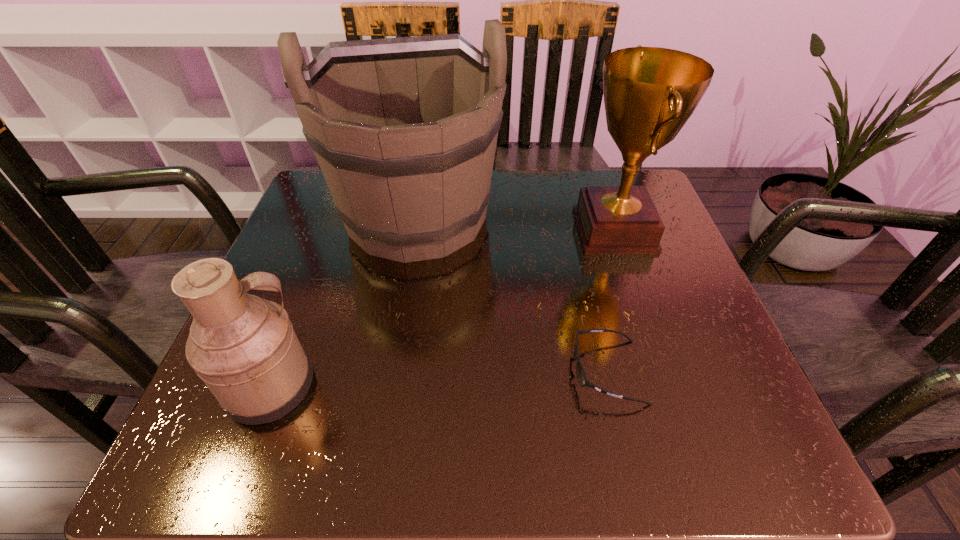
Where is `vacant space located on the front-facing side of the shortest object`? The width and height of the screenshot is (960, 540). vacant space located on the front-facing side of the shortest object is located at coordinates (443, 372).

The height and width of the screenshot is (540, 960). I want to click on vacant space located on the front-facing side of the shortest object, so click(x=490, y=372).

Find the location of `bucket at the far edge`. bucket at the far edge is located at coordinates (405, 129).

Where is `award positioned at the far edge`? This screenshot has height=540, width=960. award positioned at the far edge is located at coordinates (649, 93).

At what (x,y) coordinates should I click in order to perform the action: click on object at the near edge. Please return your answer as a coordinate pair (x, y). The height and width of the screenshot is (540, 960). Looking at the image, I should click on (244, 348).

This screenshot has width=960, height=540. Identify the location of bucket situated at the left edge. (405, 129).

The image size is (960, 540). What are the coordinates of `pitcher situated at the left edge` in the screenshot? It's located at tap(244, 348).

Locate an element on the screen. award positioned at the right edge is located at coordinates click(x=649, y=93).

Where is `sunglasses that is at the right edge`? sunglasses that is at the right edge is located at coordinates (581, 376).

Locate an element on the screen. The width and height of the screenshot is (960, 540). object present at the far left corner is located at coordinates (405, 129).